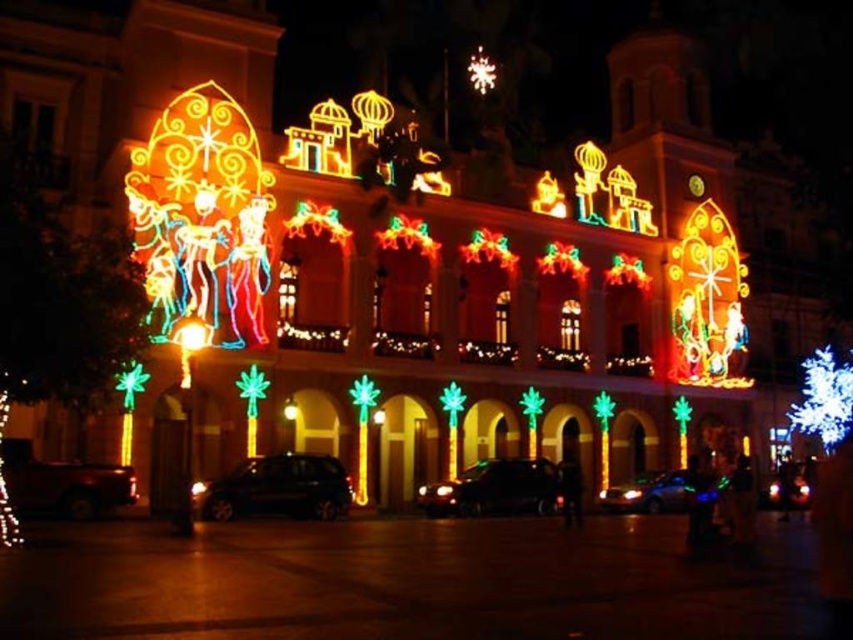
Is shiny black car at center shorter than metallic silver car at lower left?

No, shiny black car at center is not shorter than metallic silver car at lower left.

Can you confirm if shiny black car at center is taller than metallic silver car at lower left?

Yes.

Is point (543, 504) farther from camera compared to point (22, 483)?

Yes, it is behind point (22, 483).

The width and height of the screenshot is (853, 640). I want to click on shiny black car at center, so click(495, 490).

Does black glossy car at center have a greater height compared to shiny black car at center?

Yes, black glossy car at center is taller than shiny black car at center.

Is point (296, 472) farther from camera compared to point (457, 492)?

No, it is not.

Does point (267, 484) lie behind point (538, 484)?

That is False.

Locate an element on the screen. This screenshot has height=640, width=853. black glossy car at center is located at coordinates point(277,488).

Which of these two, metallic silver car at lower left or shiny blue car at center, stands taller?

With more height is shiny blue car at center.

Identify the location of metallic silver car at lower left. Image resolution: width=853 pixels, height=640 pixels. (68, 486).